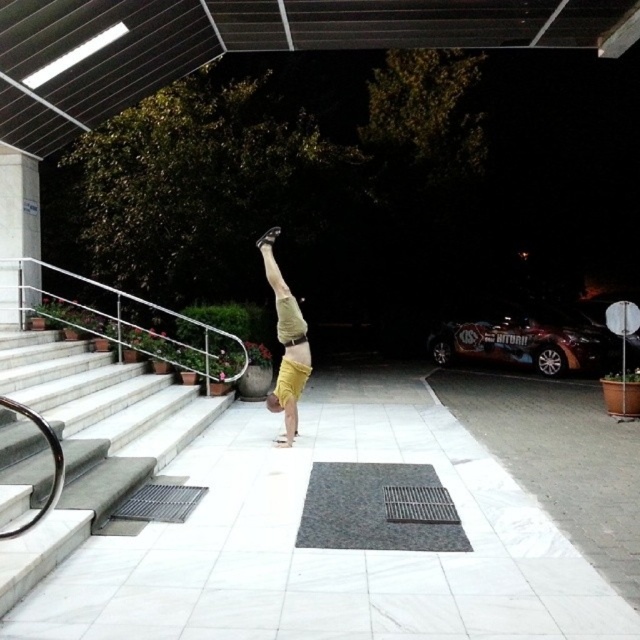
Question: Which of the following is the farthest from the observer?

Choices:
 (A) (298, 316)
 (B) (51, 378)

Answer: (B)

Question: Is white marble stairs at lower left positioned in front of yellow cotton shorts at center?

Choices:
 (A) no
 (B) yes

Answer: (B)

Question: Is white marble stairs at lower left smaller than yellow cotton shorts at center?

Choices:
 (A) no
 (B) yes

Answer: (A)

Question: Can you confirm if white marble stairs at lower left is positioned below yellow cotton shorts at center?

Choices:
 (A) yes
 (B) no

Answer: (A)